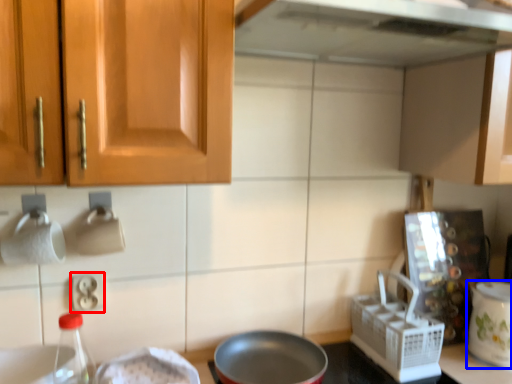
Question: Which object is further to the camera taking this photo, electric outlet (highlighted by a red box) or kitchen appliance (highlighted by a blue box)?

Choices:
 (A) electric outlet
 (B) kitchen appliance

Answer: (B)